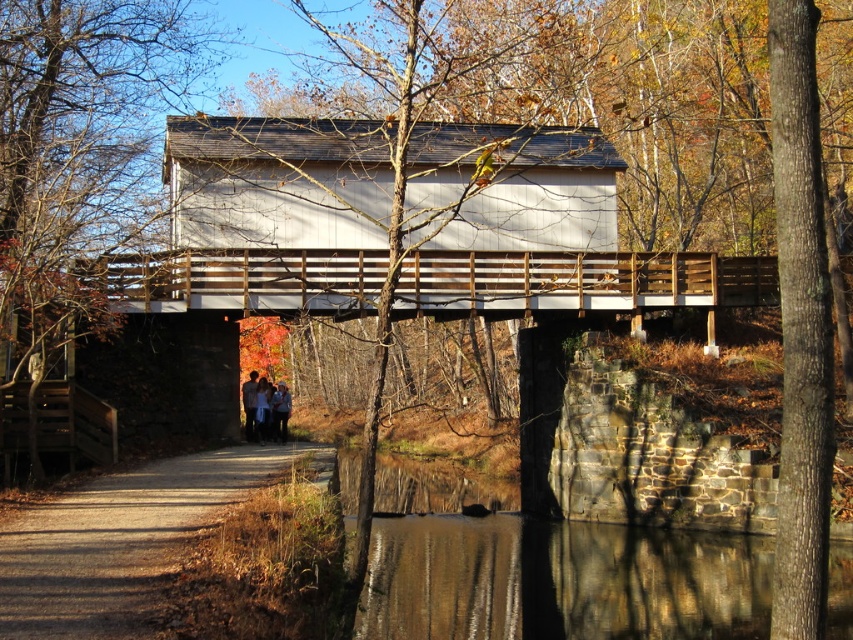
Question: Which of the following is the closest to the observer?

Choices:
 (A) brown dirt path at lower left
 (B) white cotton shirt at center

Answer: (A)

Question: Is the position of blue jeans at center less distant than that of matte gray jacket at center?

Choices:
 (A) no
 (B) yes

Answer: (B)

Question: Estimate the real-world distances between objects in this image. Which object is closer to the light blue denim jacket at center?

Choices:
 (A) matte gray jacket at center
 (B) white cotton shirt at center

Answer: (B)

Question: Estimate the real-world distances between objects in this image. Which object is closer to the white cotton shirt at center?

Choices:
 (A) brown dirt path at lower left
 (B) light blue denim jacket at center

Answer: (B)

Question: Is smooth stone wall at lower center positioned before white cotton shirt at center?

Choices:
 (A) no
 (B) yes

Answer: (B)

Question: Does brown dirt path at lower left have a larger size compared to white cotton shirt at center?

Choices:
 (A) no
 (B) yes

Answer: (B)